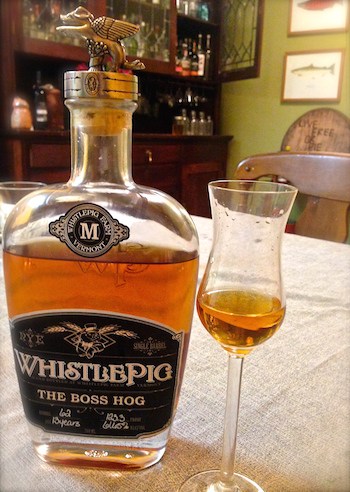
Identify the location of liquor in glass. (258, 330).